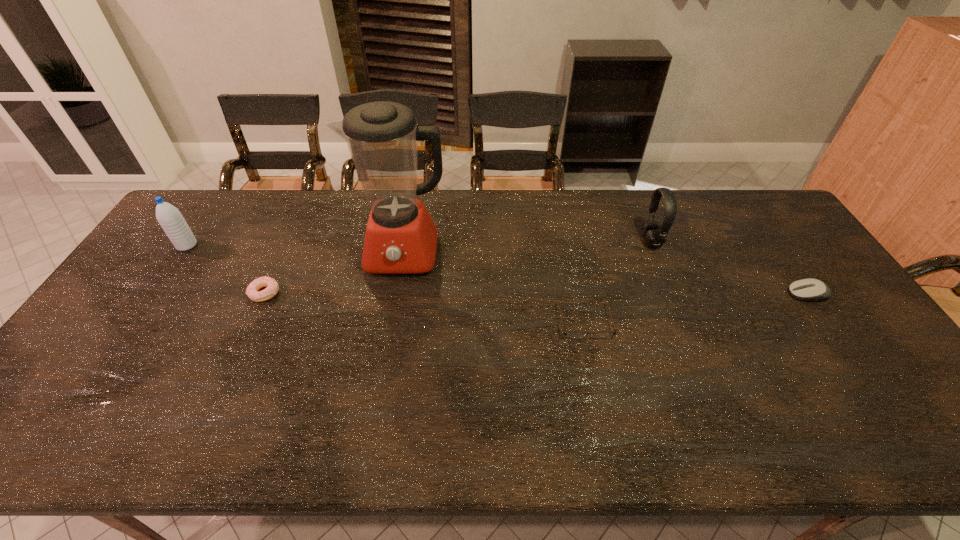
Where is `free space between the doughnut and the tallest object`? The height and width of the screenshot is (540, 960). free space between the doughnut and the tallest object is located at coordinates (334, 274).

Locate an element on the screen. free space between the headset and the doughnut is located at coordinates (458, 267).

Find the location of a particular element. vacant space in between the rightmost object and the fourth object from left to right is located at coordinates (696, 308).

Where is `empty location between the tallest object and the water bottle`? The height and width of the screenshot is (540, 960). empty location between the tallest object and the water bottle is located at coordinates (296, 249).

Image resolution: width=960 pixels, height=540 pixels. I want to click on free space between the doughnut and the leftmost object, so click(x=226, y=269).

The height and width of the screenshot is (540, 960). I want to click on the fourth closest object to the spectacles, so click(x=272, y=286).

Locate an element on the screen. The image size is (960, 540). object that is the third closest to the fourth object from right to left is located at coordinates coord(169,217).

Where is `vacant position in the image that satisfies the following two spatial constraints: 1. on the front-facing side of the fifth object from left to right; 2. on the front of the blender near the controls`? This screenshot has width=960, height=540. vacant position in the image that satisfies the following two spatial constraints: 1. on the front-facing side of the fifth object from left to right; 2. on the front of the blender near the controls is located at coordinates (656, 254).

Locate an element on the screen. free spot that satisfies the following two spatial constraints: 1. on the front-facing side of the headset; 2. on the front side of the leftmost object is located at coordinates (653, 246).